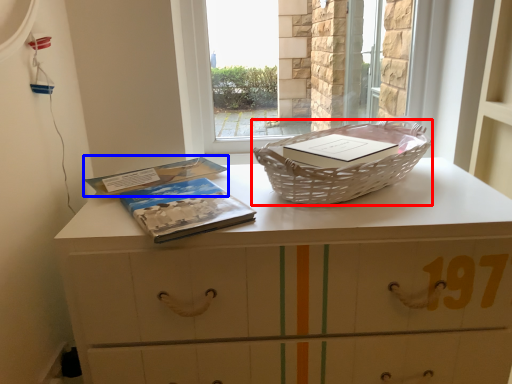
Question: Which object appears closest to the camera in this image, picnic basket (highlighted by a red box) or paperback book (highlighted by a blue box)?

Choices:
 (A) picnic basket
 (B) paperback book

Answer: (A)